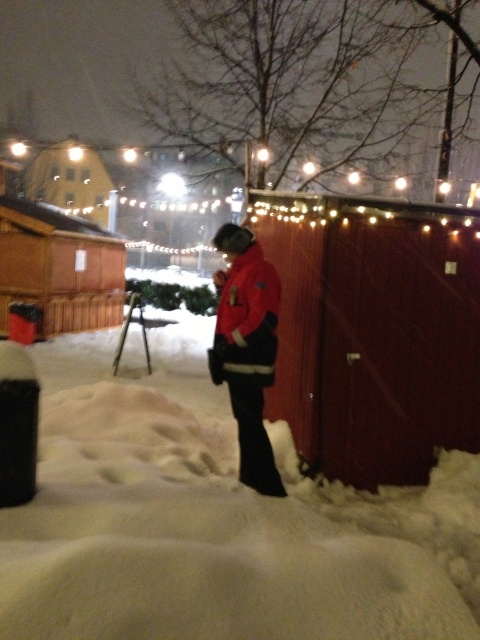
Which of these two, red matte jacket at center or metallic tripod at center, stands taller?

Standing taller between the two is red matte jacket at center.

Between point (271, 300) and point (140, 317), which one is positioned behind?

Point (140, 317)

Does point (262, 397) come farther from viewer compared to point (146, 358)?

No, (262, 397) is in front of (146, 358).

You are a GUI agent. You are given a task and a screenshot of the screen. Output one action in this format:
    pyautogui.click(x=<x>, y=<y>)
    Task: Click on the red matte jacket at center
    The height and width of the screenshot is (640, 480).
    Given the screenshot: What is the action you would take?
    pyautogui.click(x=247, y=348)

Is wooden cabin at center above wooden hut at upper center?

Actually, wooden cabin at center is below wooden hut at upper center.

Can you confirm if wooden cabin at center is thinner than wooden hut at upper center?

Indeed, wooden cabin at center has a lesser width compared to wooden hut at upper center.

Which is in front, point (469, 280) or point (68, 163)?

Positioned in front is point (469, 280).

The width and height of the screenshot is (480, 640). What are the coordinates of `wooden cabin at center` in the screenshot? It's located at (373, 332).

Who is more distant from viewer, (300, 474) or (257, 291)?

Positioned behind is point (300, 474).

Who is shorter, white fluffy snow at lower center or red matte jacket at center?

white fluffy snow at lower center

The image size is (480, 640). Find the location of `white fluffy snow at lower center`. white fluffy snow at lower center is located at coordinates (215, 520).